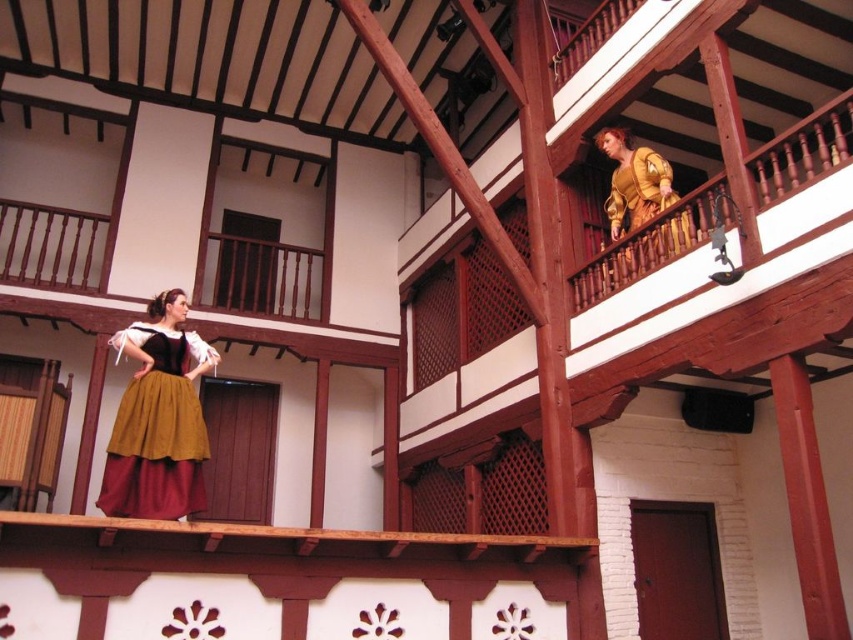
You are standing at the entrance of this wooden structure and notice a point marked at coordinates (158,419). According to the scene description, what object is located at that point?

The point at coordinates (158,419) marks the location of the matte gold skirt at center.